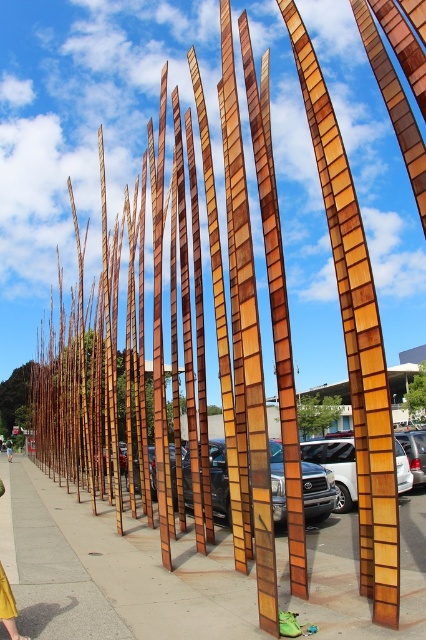
Question: Which of the following is the farthest from the observer?

Choices:
 (A) green fabric person at lower center
 (B) smooth concrete sidewalk at center

Answer: (A)

Question: Is smooth concrete sidewalk at center bigger than green fabric person at lower center?

Choices:
 (A) no
 (B) yes

Answer: (B)

Question: Can you confirm if smooth concrete sidewalk at center is positioned to the right of green fabric person at lower center?

Choices:
 (A) no
 (B) yes

Answer: (B)

Question: Which point appears farthest from the camera in this image?

Choices:
 (A) (115, 570)
 (B) (9, 445)

Answer: (B)

Question: Where is smooth concrete sidewalk at center located in relation to green fabric person at lower center in the image?

Choices:
 (A) above
 (B) below

Answer: (A)